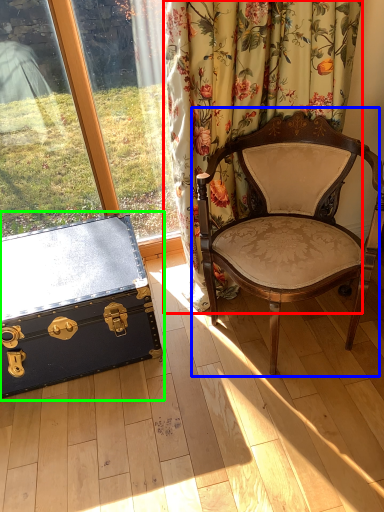
Question: Considering the real-world distances, which object is farthest from curtain (highlighted by a red box)? chair (highlighted by a blue box) or box (highlighted by a green box)?

Choices:
 (A) chair
 (B) box

Answer: (B)